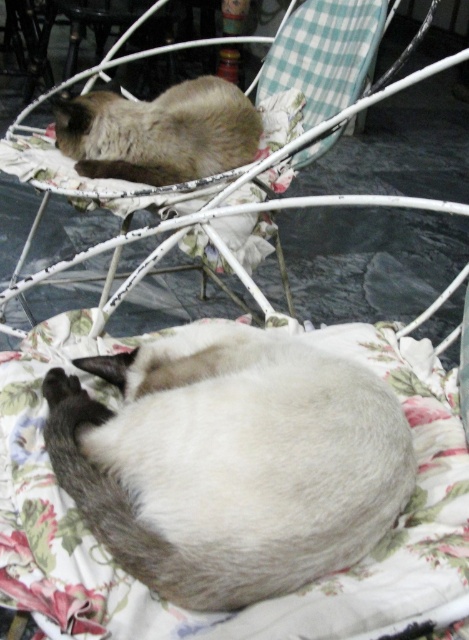
Question: Does smokey gray fur at upper left appear over fluffy fabric chair at upper center?

Choices:
 (A) no
 (B) yes

Answer: (A)

Question: Which object is closer to the camera taking this photo?

Choices:
 (A) smokey gray fur at upper left
 (B) silky white cat at center

Answer: (B)

Question: Considering the relative positions of smokey gray fur at upper left and fluffy fabric chair at upper center in the image provided, where is smokey gray fur at upper left located with respect to fluffy fabric chair at upper center?

Choices:
 (A) below
 (B) above

Answer: (A)

Question: Based on their relative distances, which object is nearer to the silky white cat at center?

Choices:
 (A) fluffy fabric chair at upper center
 (B) smokey gray fur at upper left

Answer: (A)

Question: Among these points, which one is farthest from the camera?

Choices:
 (A) (341, 19)
 (B) (370, 458)
 (C) (166, 184)

Answer: (A)

Question: Observing the image, what is the correct spatial positioning of silky white cat at center in reference to fluffy fabric chair at upper center?

Choices:
 (A) left
 (B) right

Answer: (A)